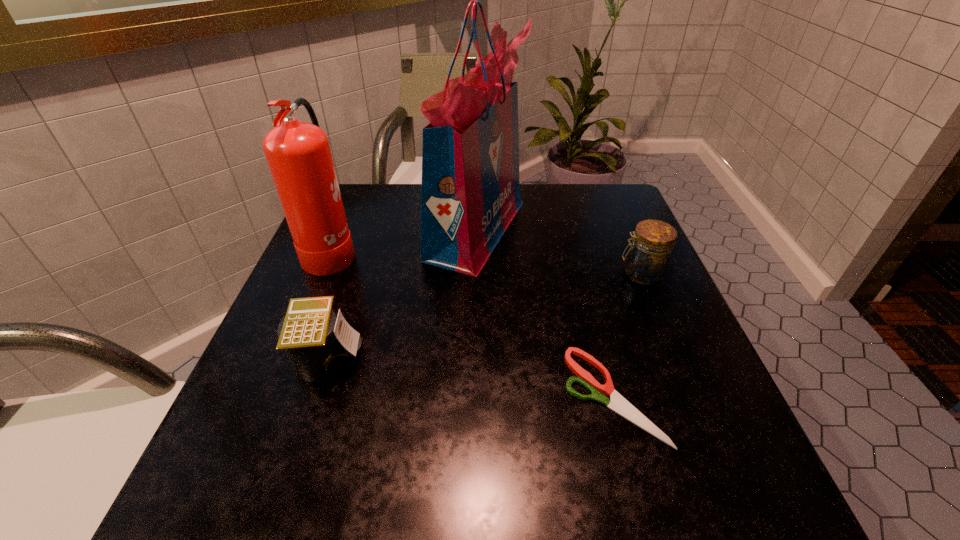
Identify the location of scissors at the right edge. (617, 403).

You are a GUI agent. You are given a task and a screenshot of the screen. Output one action in this format:
    pyautogui.click(x=<x>, y=<y>)
    Task: Click on the object that is positioned at the far left corner
    This screenshot has width=960, height=540.
    Given the screenshot: What is the action you would take?
    pyautogui.click(x=299, y=157)

Locate an element on the screen. The height and width of the screenshot is (540, 960). vacant space at the far edge is located at coordinates (525, 210).

Locate an element on the screen. vacant region at the near edge of the desktop is located at coordinates (420, 488).

This screenshot has height=540, width=960. I want to click on blank area at the left edge, so click(296, 436).

At what (x,y) coordinates should I click in order to perform the action: click on vacant space at the right edge of the desktop. Please return your answer as a coordinate pair (x, y). This screenshot has width=960, height=540. Looking at the image, I should click on (615, 237).

Identify the location of blank space at the near left corner of the desktop. (210, 458).

Locate an element on the screen. vacant space at the far right corner of the desktop is located at coordinates (595, 199).

Identify the location of empty space between the second object from right to left and the fire extinguisher. (472, 323).

I want to click on unoccupied position between the second shortest object and the grocery bag, so click(x=402, y=294).